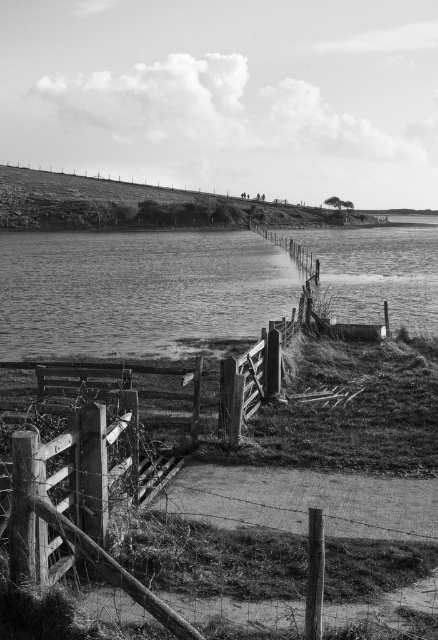
Question: Among these points, which one is nearest to the camera?

Choices:
 (A) (55, 461)
 (B) (17, 260)

Answer: (A)

Question: Does smooth water at lower left appear under wooden gate at lower left?

Choices:
 (A) no
 (B) yes

Answer: (A)

Question: Is smooth water at lower left to the right of wooden gate at lower left from the viewer's perspective?

Choices:
 (A) yes
 (B) no

Answer: (B)

Question: Can you confirm if smooth water at lower left is smaller than wooden gate at lower left?

Choices:
 (A) no
 (B) yes

Answer: (A)

Question: Which point is farther to the camera?

Choices:
 (A) smooth water at lower left
 (B) wooden gate at lower left

Answer: (A)